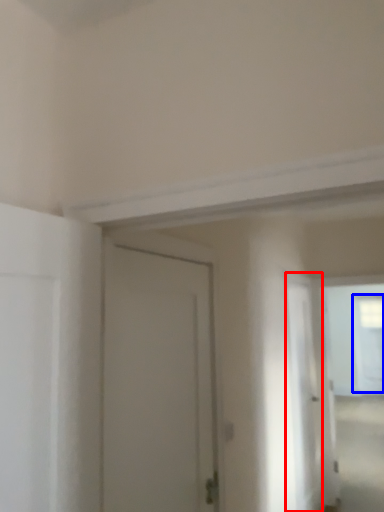
Question: Which object appears closest to the camera in this image, screen door (highlighted by a red box) or window (highlighted by a blue box)?

Choices:
 (A) screen door
 (B) window

Answer: (A)